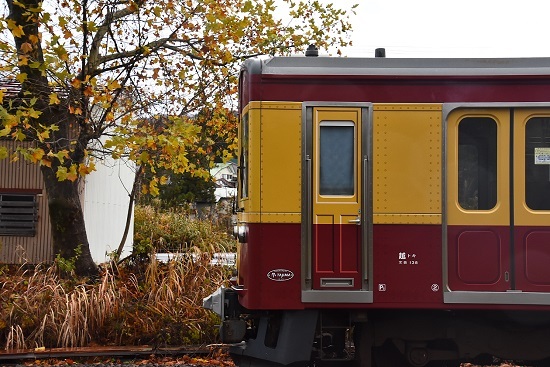
Identify the location of window. The height and width of the screenshot is (367, 550). (331, 150), (483, 163), (536, 183).